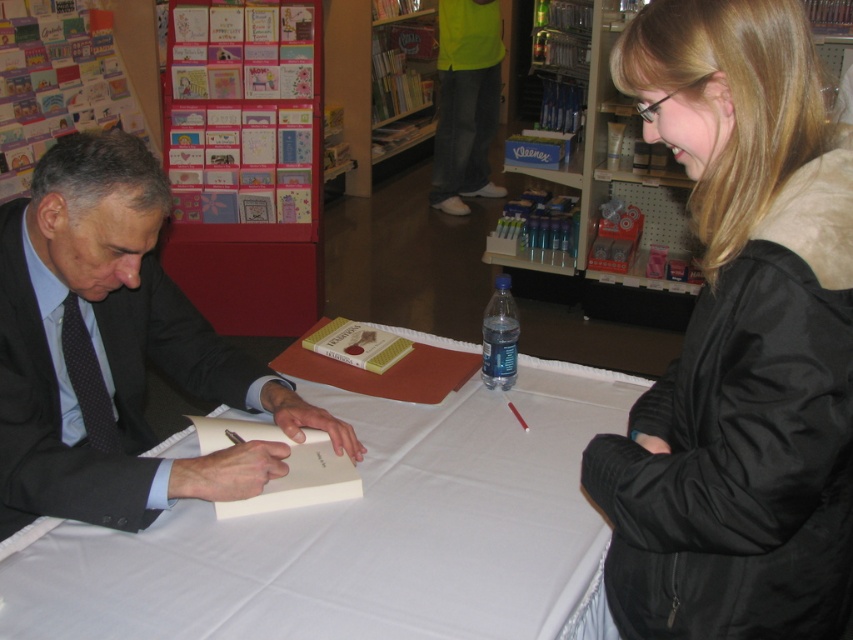
Question: Considering the real-world distances, which object is farthest from the black fuzzy coat at upper right?

Choices:
 (A) white cloth table at center
 (B) neon yellow shirt at upper center
 (C) wooden bookshelf at center

Answer: (C)

Question: Is dark gray suit at left below wooden shelves at upper right?

Choices:
 (A) yes
 (B) no

Answer: (A)

Question: Can you confirm if black fuzzy coat at upper right is positioned to the left of dark gray suit at left?

Choices:
 (A) no
 (B) yes

Answer: (A)

Question: Which of the following is the farthest from the observer?

Choices:
 (A) (677, 241)
 (B) (201, 92)

Answer: (A)

Question: Is cardboard greeting cards at upper left positioned at the back of wooden shelves at upper right?

Choices:
 (A) yes
 (B) no

Answer: (B)

Question: Which point is closer to the camera?

Choices:
 (A) (340, 51)
 (B) (560, 380)
 (C) (440, 36)

Answer: (B)